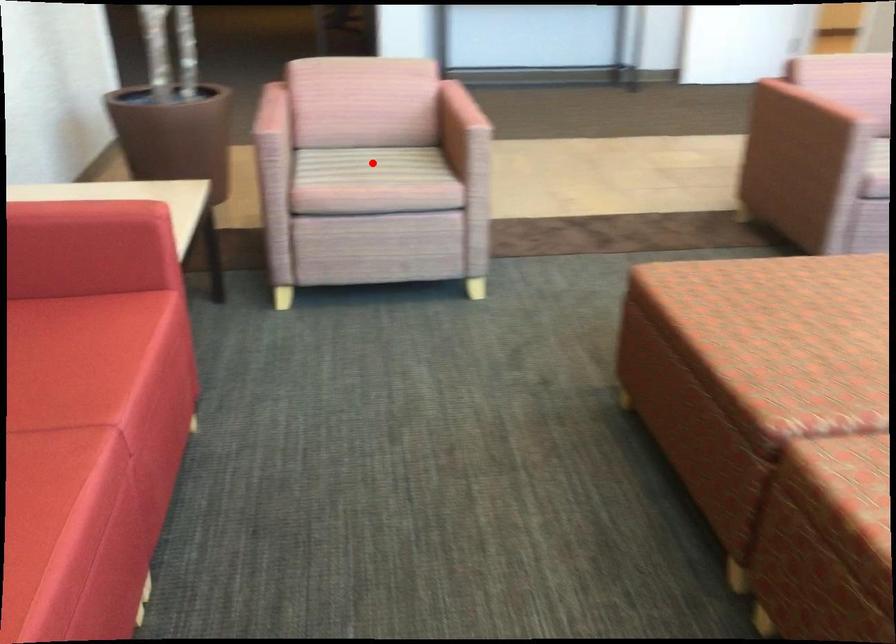
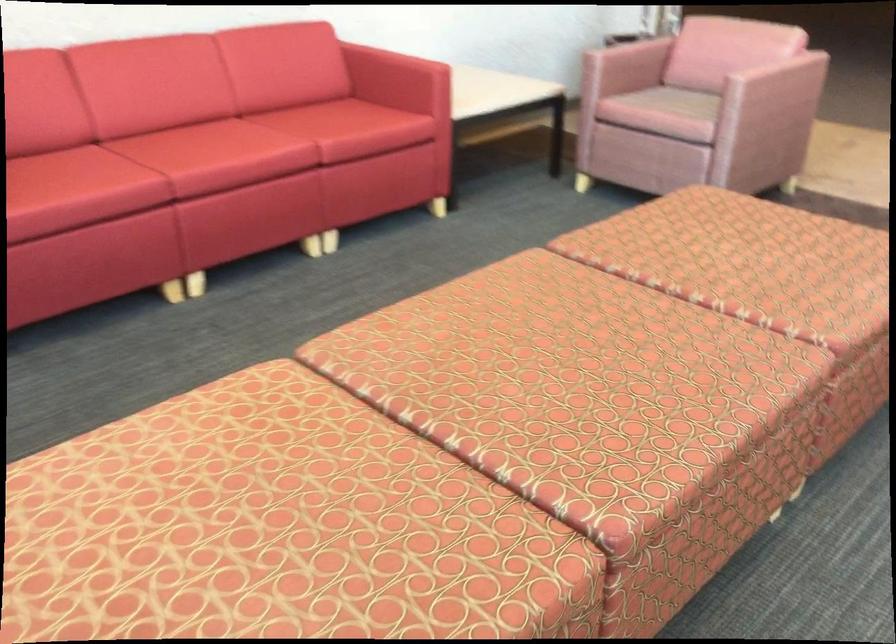
In the second image, find the point that corresponds to the highlighted location in the first image.

(686, 102)